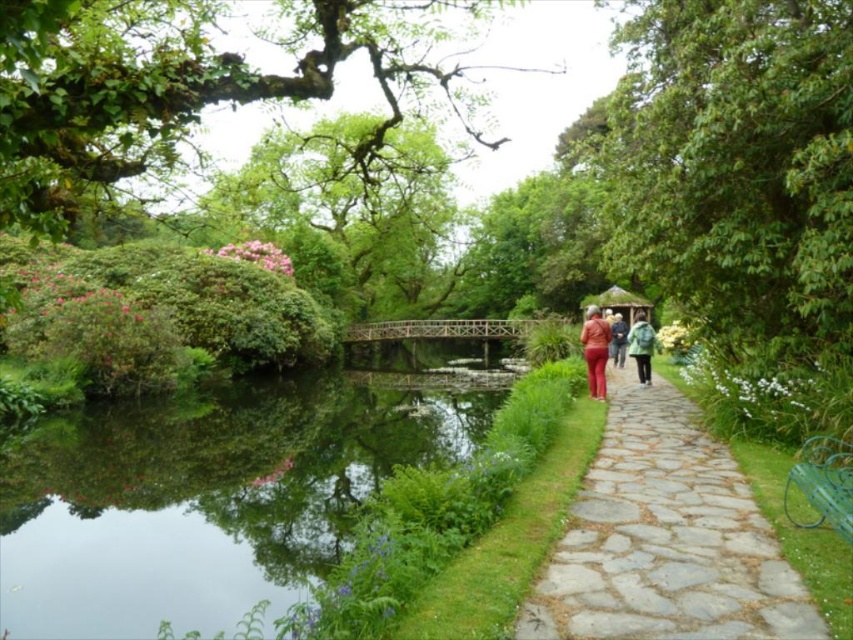
Question: Which point is farther to the camera?

Choices:
 (A) (610, 336)
 (B) (312, 64)
 (C) (622, 353)
 (D) (646, 348)

Answer: (C)

Question: Can you confirm if matte red jacket at center is positioned above green matte jacket at center-right?

Choices:
 (A) no
 (B) yes

Answer: (A)

Question: Is stone at right below green matte jacket at center-right?

Choices:
 (A) yes
 (B) no

Answer: (A)

Question: Estimate the real-world distances between objects in this image. Which object is farther from the green leafy tree at right?

Choices:
 (A) stone at right
 (B) green wool coat at center

Answer: (B)

Question: Which object is the closest to the green mossy branch at upper left?

Choices:
 (A) green wool coat at center
 (B) green reflective water at lower left
 (C) matte red pants at center
 (D) stone at right

Answer: (B)

Question: Is matte red jacket at center bigger than green wool coat at center?

Choices:
 (A) no
 (B) yes

Answer: (B)